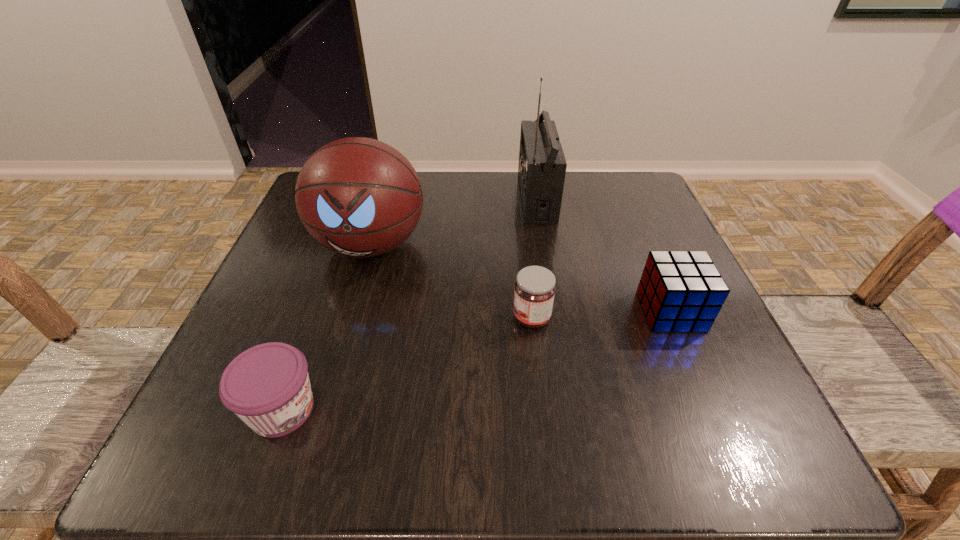
This screenshot has width=960, height=540. Find the location of `object present at the near left corner`. object present at the near left corner is located at coordinates (267, 386).

Locate an element on the screen. The width and height of the screenshot is (960, 540). vacant space at the far edge of the desktop is located at coordinates (507, 201).

In the image, there is a desktop. Identify the location of vacant space at the near edge. (540, 448).

You are a GUI agent. You are given a task and a screenshot of the screen. Output one action in this format:
    pyautogui.click(x=<x>, y=<y>)
    Task: Click on the vacant area at the left edge of the desktop
    Image resolution: width=960 pixels, height=540 pixels.
    Given the screenshot: What is the action you would take?
    (276, 289)

This screenshot has height=540, width=960. In the image, there is a desktop. In order to click on free space at the right edge in this screenshot , I will do `click(670, 335)`.

You are a GUI agent. You are given a task and a screenshot of the screen. Output one action in this format:
    pyautogui.click(x=<x>, y=<y>)
    Task: Click on the vacant region at the near left corner
    
    Given the screenshot: What is the action you would take?
    pos(294,445)

Locate an element on the screen. The width and height of the screenshot is (960, 540). free location at the far right corner of the desktop is located at coordinates (593, 177).

Locate an element on the screen. Image resolution: width=960 pixels, height=540 pixels. free area in between the nearer jam and the fourth shortest object is located at coordinates (326, 327).

The image size is (960, 540). I want to click on empty location between the nearer jam and the cube, so click(x=476, y=360).

I want to click on vacant space in between the basketball and the left jam, so click(x=326, y=327).